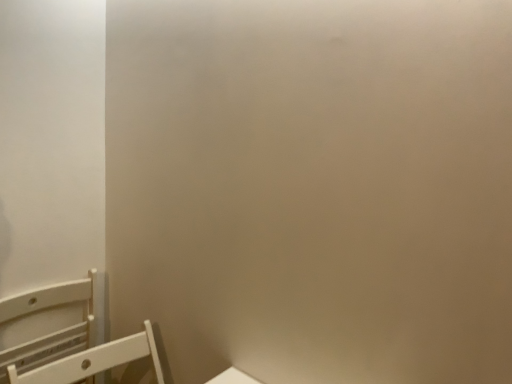
Locate an element on the screen. The width and height of the screenshot is (512, 384). white matte chair at lower left, marked as the second furniture in a left-to-right arrangement is located at coordinates (94, 361).

Image resolution: width=512 pixels, height=384 pixels. What do you see at coordinates (94, 361) in the screenshot?
I see `white matte chair at lower left, marked as the second furniture in a left-to-right arrangement` at bounding box center [94, 361].

At what (x,y) coordinates should I click in order to perform the action: click on white plastic chair at lower left, the second furniture viewed from the right. Please return your answer as a coordinate pair (x, y). Looking at the image, I should click on (50, 333).

What do you see at coordinates (50, 333) in the screenshot? I see `white plastic chair at lower left, the 1th furniture in the left-to-right sequence` at bounding box center [50, 333].

Identify the location of white matte chair at lower left, the 1th furniture in the right-to-left sequence. (94, 361).

Considering the positions of objects white matte chair at lower left, the 1th furniture in the right-to-left sequence, and white plastic chair at lower left, the second furniture viewed from the right, in the image provided, who is more to the right, white matte chair at lower left, the 1th furniture in the right-to-left sequence, or white plastic chair at lower left, the second furniture viewed from the right,?

Positioned to the right is white matte chair at lower left, the 1th furniture in the right-to-left sequence.

Is the position of white matte chair at lower left, the 1th furniture in the right-to-left sequence, less distant than that of white plastic chair at lower left, the second furniture viewed from the right?

Yes, white matte chair at lower left, the 1th furniture in the right-to-left sequence, is in front of white plastic chair at lower left, the second furniture viewed from the right.

Which is behind, point (90, 370) or point (78, 286)?

The point (78, 286) is farther from the camera.

From the picture: From the image's perspective, is white matte chair at lower left, marked as the second furniture in a left-to-right arrangement, below white plastic chair at lower left, the second furniture viewed from the right?

Indeed, from the image's perspective, white matte chair at lower left, marked as the second furniture in a left-to-right arrangement, is shown beneath white plastic chair at lower left, the second furniture viewed from the right.

From a real-world perspective, is white matte chair at lower left, the 1th furniture in the right-to-left sequence, physically below white plastic chair at lower left, the 1th furniture in the left-to-right sequence?

No, from a real-world perspective, white matte chair at lower left, the 1th furniture in the right-to-left sequence, is not beneath white plastic chair at lower left, the 1th furniture in the left-to-right sequence.

Between white matte chair at lower left, marked as the second furniture in a left-to-right arrangement, and white plastic chair at lower left, the 1th furniture in the left-to-right sequence, which one has larger width?

white matte chair at lower left, marked as the second furniture in a left-to-right arrangement.

In terms of height, does white matte chair at lower left, marked as the second furniture in a left-to-right arrangement, look taller or shorter compared to white plastic chair at lower left, the 1th furniture in the left-to-right sequence?

Considering their sizes, white matte chair at lower left, marked as the second furniture in a left-to-right arrangement, has less height than white plastic chair at lower left, the 1th furniture in the left-to-right sequence.

Does white matte chair at lower left, marked as the second furniture in a left-to-right arrangement, have a larger size compared to white plastic chair at lower left, the 1th furniture in the left-to-right sequence?

Correct, white matte chair at lower left, marked as the second furniture in a left-to-right arrangement, is larger in size than white plastic chair at lower left, the 1th furniture in the left-to-right sequence.

Is white plastic chair at lower left, the 1th furniture in the left-to-right sequence, surrounded by white matte chair at lower left, marked as the second furniture in a left-to-right arrangement?

Actually, white plastic chair at lower left, the 1th furniture in the left-to-right sequence, is outside white matte chair at lower left, marked as the second furniture in a left-to-right arrangement.

Is white matte chair at lower left, marked as the second furniture in a left-to-right arrangement, far from white plastic chair at lower left, the 1th furniture in the left-to-right sequence?

white matte chair at lower left, marked as the second furniture in a left-to-right arrangement, is actually quite close to white plastic chair at lower left, the 1th furniture in the left-to-right sequence.

From the picture: Does white matte chair at lower left, the 1th furniture in the right-to-left sequence, turn towards white plastic chair at lower left, the 1th furniture in the left-to-right sequence?

No, white matte chair at lower left, the 1th furniture in the right-to-left sequence, is not oriented towards white plastic chair at lower left, the 1th furniture in the left-to-right sequence.

How different are the orientations of white matte chair at lower left, the 1th furniture in the right-to-left sequence, and white plastic chair at lower left, the second furniture viewed from the right, in degrees?

0.0012 degrees separate the facing orientations of white matte chair at lower left, the 1th furniture in the right-to-left sequence, and white plastic chair at lower left, the second furniture viewed from the right.

Find the location of a particular element. furniture that appears below the white plastic chair at lower left, the second furniture viewed from the right (from the image's perspective) is located at coordinates (94, 361).

Is white plastic chair at lower left, the 1th furniture in the left-to-right sequence, to the left or to the right of white matte chair at lower left, marked as the second furniture in a left-to-right arrangement, in the image?

From the image, it's evident that white plastic chair at lower left, the 1th furniture in the left-to-right sequence, is to the left of white matte chair at lower left, marked as the second furniture in a left-to-right arrangement.

Considering the positions of objects white plastic chair at lower left, the 1th furniture in the left-to-right sequence, and white matte chair at lower left, marked as the second furniture in a left-to-right arrangement, in the image provided, who is in front, white plastic chair at lower left, the 1th furniture in the left-to-right sequence, or white matte chair at lower left, marked as the second furniture in a left-to-right arrangement,?

white matte chair at lower left, marked as the second furniture in a left-to-right arrangement.

Which point is more distant from viewer, (64, 353) or (89, 366)?

Positioned behind is point (64, 353).

From the image's perspective, is white plastic chair at lower left, the second furniture viewed from the right, beneath white matte chair at lower left, marked as the second furniture in a left-to-right arrangement?

Incorrect, from the image's perspective, white plastic chair at lower left, the second furniture viewed from the right, is higher than white matte chair at lower left, marked as the second furniture in a left-to-right arrangement.

From a real-world perspective, is white plastic chair at lower left, the second furniture viewed from the right, below white matte chair at lower left, marked as the second furniture in a left-to-right arrangement?

Yes.

Does white plastic chair at lower left, the second furniture viewed from the right, have a lesser width compared to white matte chair at lower left, the 1th furniture in the right-to-left sequence?

Correct, the width of white plastic chair at lower left, the second furniture viewed from the right, is less than that of white matte chair at lower left, the 1th furniture in the right-to-left sequence.

Is white plastic chair at lower left, the second furniture viewed from the right, taller than white matte chair at lower left, marked as the second furniture in a left-to-right arrangement?

Yes, white plastic chair at lower left, the second furniture viewed from the right, is taller than white matte chair at lower left, marked as the second furniture in a left-to-right arrangement.

Between white plastic chair at lower left, the second furniture viewed from the right, and white matte chair at lower left, marked as the second furniture in a left-to-right arrangement, which one has smaller size?

white plastic chair at lower left, the second furniture viewed from the right.

Is white plastic chair at lower left, the second furniture viewed from the right, located outside white matte chair at lower left, the 1th furniture in the right-to-left sequence?

Yes.

In the scene shown: Is white plastic chair at lower left, the 1th furniture in the left-to-right sequence, not close to white matte chair at lower left, the 1th furniture in the right-to-left sequence?

No.

Is white plastic chair at lower left, the 1th furniture in the left-to-right sequence, facing towards white matte chair at lower left, the 1th furniture in the right-to-left sequence?

Yes, white plastic chair at lower left, the 1th furniture in the left-to-right sequence, is facing white matte chair at lower left, the 1th furniture in the right-to-left sequence.

How many degrees apart are the facing directions of white plastic chair at lower left, the second furniture viewed from the right, and white matte chair at lower left, the 1th furniture in the right-to-left sequence?

white plastic chair at lower left, the second furniture viewed from the right, and white matte chair at lower left, the 1th furniture in the right-to-left sequence, are facing 0.0012 degrees away from each other.

Where is `furniture located underneath the white matte chair at lower left, the 1th furniture in the right-to-left sequence (from a real-world perspective)`? The image size is (512, 384). furniture located underneath the white matte chair at lower left, the 1th furniture in the right-to-left sequence (from a real-world perspective) is located at coordinates [x=50, y=333].

This screenshot has height=384, width=512. What are the coordinates of `furniture to the left of white matte chair at lower left, marked as the second furniture in a left-to-right arrangement` in the screenshot? It's located at (50, 333).

Image resolution: width=512 pixels, height=384 pixels. In the image, there is a white matte chair at lower left, marked as the second furniture in a left-to-right arrangement. In order to click on furniture below it (from a real-world perspective) in this screenshot , I will do `click(50, 333)`.